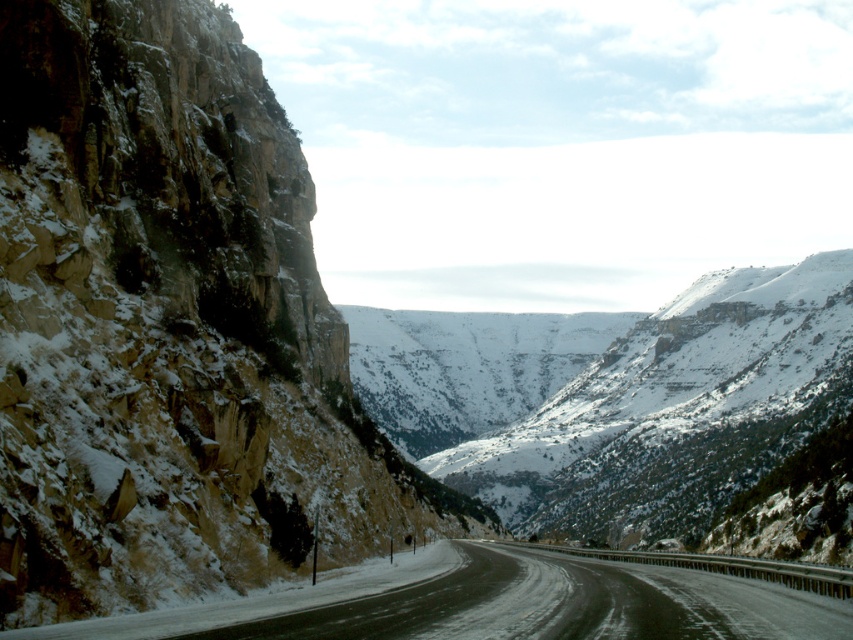
Question: Which object appears closest to the camera in this image?

Choices:
 (A) rugged stone cliff at left
 (B) slick asphalt highway at center

Answer: (B)

Question: Where is rugged stone cliff at left located in relation to slick asphalt highway at center in the image?

Choices:
 (A) above
 (B) below

Answer: (A)

Question: Among these objects, which one is nearest to the camera?

Choices:
 (A) slick asphalt highway at center
 (B) rugged stone cliff at left

Answer: (A)

Question: Is rugged stone cliff at left to the left of slick asphalt highway at center from the viewer's perspective?

Choices:
 (A) yes
 (B) no

Answer: (A)

Question: Is rugged stone cliff at left to the right of slick asphalt highway at center from the viewer's perspective?

Choices:
 (A) yes
 (B) no

Answer: (B)